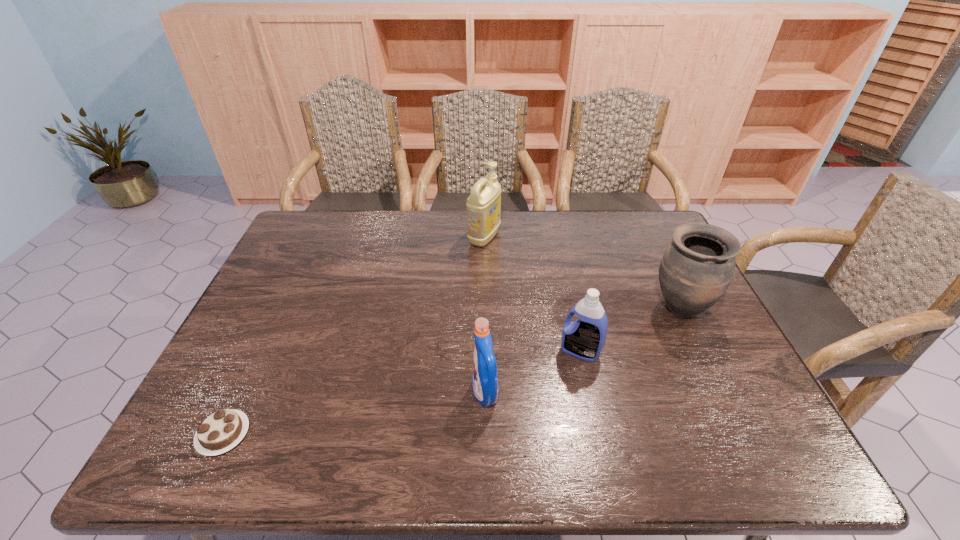
Locate an element on the screen. The width and height of the screenshot is (960, 540). free space that is in between the urn and the tallest detergent is located at coordinates (582, 273).

Find the location of `free spot between the nearest detergent and the shortest object`. free spot between the nearest detergent and the shortest object is located at coordinates (354, 414).

Where is `free space between the urn and the second nearest detergent`? This screenshot has width=960, height=540. free space between the urn and the second nearest detergent is located at coordinates (630, 330).

Image resolution: width=960 pixels, height=540 pixels. I want to click on free point between the fourth nearest object and the farthest object, so click(582, 273).

I want to click on vacant space in between the farthest object and the chocolate cake, so click(354, 336).

The width and height of the screenshot is (960, 540). What are the coordinates of `vacant area that lies between the tallest detergent and the second farthest object` in the screenshot? It's located at (582, 273).

Locate which object is the second closest to the third nearest object. Please provide its 2D coordinates. Your answer should be formatted as a tuple, i.e. [(x, y)], where the tuple contains the x and y coordinates of a point satisfying the conditions above.

[(697, 267)]

Find the location of a particular element. The height and width of the screenshot is (540, 960). the closest object to the nearest detergent is located at coordinates (584, 338).

Point out which detergent is positioned as the second nearest to the farthest object. Please provide its 2D coordinates. Your answer should be formatted as a tuple, i.e. [(x, y)], where the tuple contains the x and y coordinates of a point satisfying the conditions above.

[(485, 386)]

Identify which detergent is the third closest to the chocolate cake. Please provide its 2D coordinates. Your answer should be formatted as a tuple, i.e. [(x, y)], where the tuple contains the x and y coordinates of a point satisfying the conditions above.

[(483, 205)]